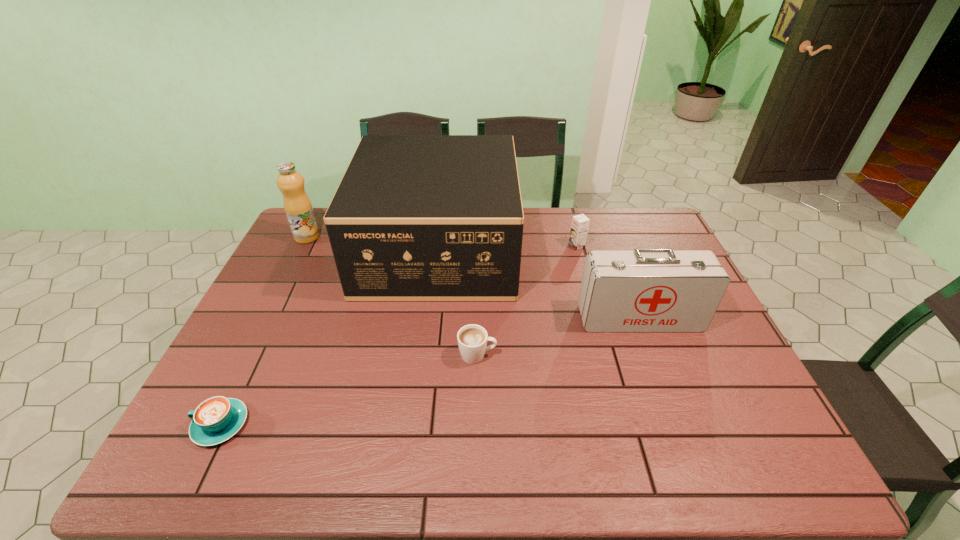
Locate an element on the screen. Image resolution: width=960 pixels, height=540 pixels. vacant area situated on the front label of the fruit juice is located at coordinates (346, 237).

Where is `vacant space situated on the front-facing side of the third nearest object`? vacant space situated on the front-facing side of the third nearest object is located at coordinates (674, 411).

This screenshot has width=960, height=540. In order to click on free space located 0.210m on the right of the third shortest object in this screenshot , I will do `click(647, 246)`.

The height and width of the screenshot is (540, 960). I want to click on free space located with the handle on the side of the fifth tallest object, so click(x=645, y=355).

The image size is (960, 540). What are the coordinates of `box that is at the far edge` in the screenshot? It's located at (415, 217).

Find the location of a particular element. fruit juice situated at the far edge is located at coordinates (298, 208).

Where is `chocolate milk located in the far edge section of the desktop`? Image resolution: width=960 pixels, height=540 pixels. chocolate milk located in the far edge section of the desktop is located at coordinates (580, 223).

Find the location of `object at the near edge`. object at the near edge is located at coordinates (215, 420).

Where is `fruit juice that is at the left edge`? Image resolution: width=960 pixels, height=540 pixels. fruit juice that is at the left edge is located at coordinates (298, 208).

Identify the location of cappuccino at the left edge. (215, 420).